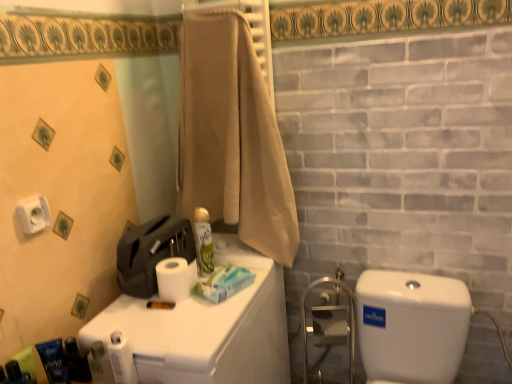
Question: Based on their positions, is blue matte toiletry at lower left, the third toiletry when ordered from right to left, located to the left or right of metallic blue soap dispenser at lower left, the fourth toiletry in the left-to-right sequence?

Choices:
 (A) left
 (B) right

Answer: (A)

Question: In the image, is blue matte toiletry at lower left, the third toiletry when ordered from right to left, positioned in front of or behind metallic blue soap dispenser at lower left, the 2th toiletry when ordered from right to left?

Choices:
 (A) front
 (B) behind

Answer: (A)

Question: Which object is the closest to the blue matte toiletry at lower left, placed as the 3th toiletry when sorted from back to front?

Choices:
 (A) white glossy water tank at right
 (B) beige cotton towel at upper center
 (C) blue matte tube at lower left, the fourth toiletry from the right
 (D) black plastic razor at lower left, marked as the 5th toiletry in a back-to-front arrangement
 (E) white matte toilet paper at lower left, the first toilet paper from the bottom

Answer: (C)

Question: Estimate the real-world distances between objects in this image. Which object is closer to the white matte toilet paper at left, arranged as the 3th toilet paper when ordered from the bottom?

Choices:
 (A) white matte toilet paper at upper center, placed as the second toilet paper when sorted from top to bottom
 (B) white glossy water tank at right
 (C) beige cotton towel at upper center
 (D) green matte spray can at center, placed as the first toiletry when sorted from back to front
 (E) blue matte tube at lower left, the fourth toiletry from the right

Answer: (E)